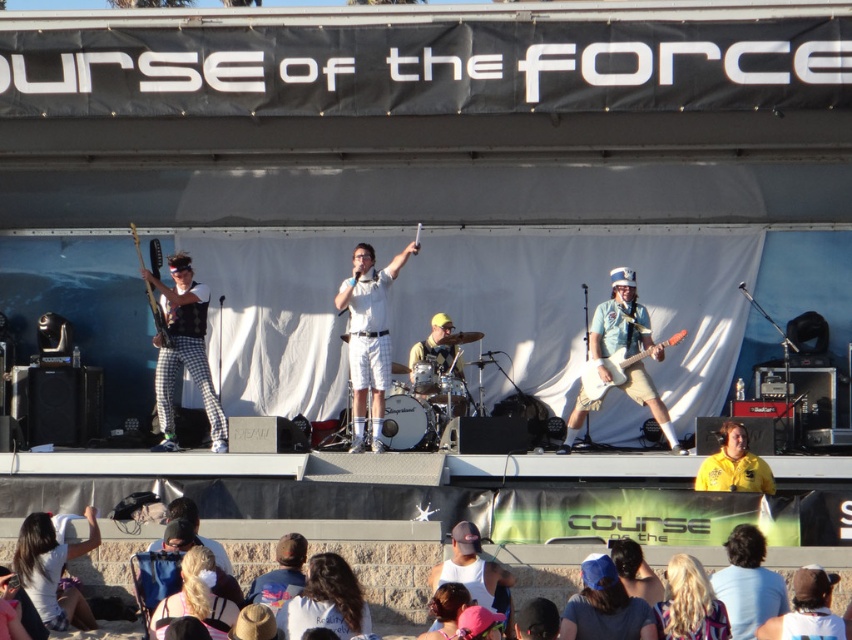
You are standing in the audience looking at the stage. There are two points marked on the stage. One is at coordinates point (49,515) and the other is at point (586,371). Which point is closer to you?

Point (49,515) is closer to the viewer than point (586,371).

You are standing in the audience looking at the stage. There are two points marked on the stage at coordinates point (764, 614) and point (781, 621). Which point is closer to you?

Point (764, 614) is closer to you because it is further to the viewer than point (781, 621).

You are a stagehand preparing to move equipment. You need to place a 10 feet long ladder between the white cotton shirt at lower left and the wooden electric guitar at center. Is there enough space for the ladder to fit horizontally between them?

The distance between the white cotton shirt at lower left and the wooden electric guitar at center is 40.48 feet, which is more than enough to fit a 10 feet long ladder horizontally between them.